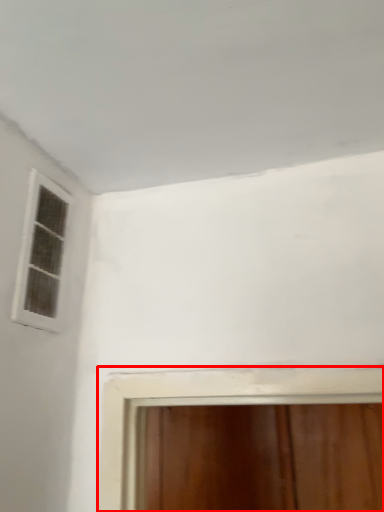
Question: From the image's perspective, where is window (annotated by the red box) located relative to window?

Choices:
 (A) above
 (B) below

Answer: (B)